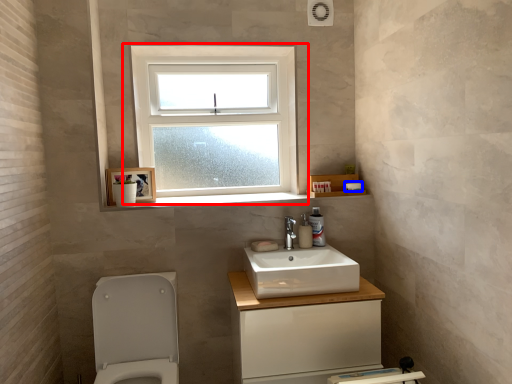
Question: Which point is further to the camera, window (highlighted by a red box) or toilet paper (highlighted by a blue box)?

Choices:
 (A) window
 (B) toilet paper

Answer: (A)